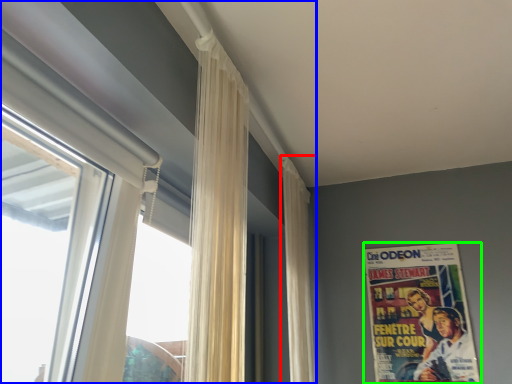
Question: Which object is positioned farthest from curtain (highlighted by a red box)? Select from window (highlighted by a blue box) and poster (highlighted by a green box).

Choices:
 (A) window
 (B) poster

Answer: (A)